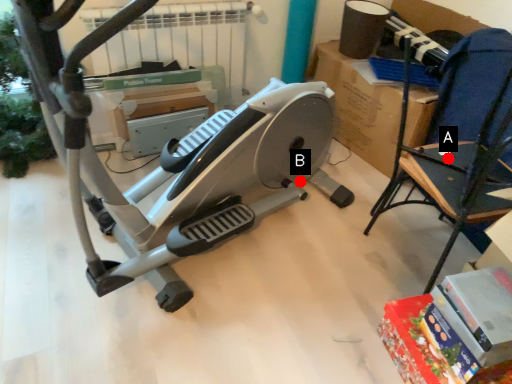
Question: Two points are circled on the image, labeled by A and B beside each circle. Which of the following is the closest to the observer?

Choices:
 (A) A is closer
 (B) B is closer

Answer: (A)